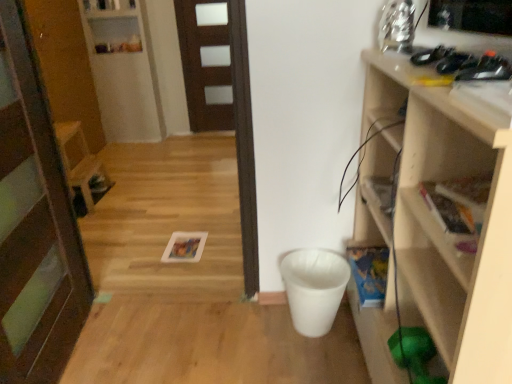
Question: Is white glossy shelf at upper left, the second shelf positioned from the right, bigger than brown matte door at center, placed as the 1th door when sorted from back to front?

Choices:
 (A) no
 (B) yes

Answer: (B)

Question: From a real-world perspective, is white glossy shelf at upper left, which ranks as the 2th shelf in front-to-back order, physically below brown matte door at center, placed as the 1th door when sorted from back to front?

Choices:
 (A) no
 (B) yes

Answer: (A)

Question: Is white glossy shelf at upper left, which ranks as the 2th shelf in front-to-back order, touching brown matte door at center, placed as the 1th door when sorted from back to front?

Choices:
 (A) no
 (B) yes

Answer: (A)

Question: Is there a large distance between white glossy shelf at upper left, the second shelf when ordered from bottom to top, and brown matte door at center, acting as the first door starting from the right?

Choices:
 (A) yes
 (B) no

Answer: (B)

Question: Does white glossy shelf at upper left, the first shelf positioned from the left, lie in front of brown matte door at center, which is the 2th door in left-to-right order?

Choices:
 (A) yes
 (B) no

Answer: (A)

Question: Is white glossy shelf at upper left, which ranks as the 2th shelf in front-to-back order, taller than brown matte door at center, which is the 2th door in left-to-right order?

Choices:
 (A) yes
 (B) no

Answer: (A)

Question: Can you confirm if wooden chair at left is shorter than brown matte door at center, which is the 2th door in left-to-right order?

Choices:
 (A) no
 (B) yes

Answer: (B)

Question: Is wooden chair at left placed right next to brown matte door at center, acting as the first door starting from the top?

Choices:
 (A) yes
 (B) no

Answer: (B)

Question: Is wooden chair at left oriented towards brown matte door at center, which appears as the second door when viewed from the front?

Choices:
 (A) yes
 (B) no

Answer: (B)

Question: Considering the relative positions of wooden chair at left and brown matte door at center, acting as the first door starting from the right, in the image provided, is wooden chair at left behind brown matte door at center, acting as the first door starting from the right,?

Choices:
 (A) yes
 (B) no

Answer: (B)

Question: Is brown matte door at center, acting as the first door starting from the right, inside wooden chair at left?

Choices:
 (A) no
 (B) yes

Answer: (A)

Question: Is the depth of wooden chair at left less than that of brown matte door at center, acting as the first door starting from the top?

Choices:
 (A) no
 (B) yes

Answer: (B)

Question: Is brown matte door at center, the second door ordered from the bottom, looking in the opposite direction of wooden door at center, marked as the second door in a right-to-left arrangement?

Choices:
 (A) no
 (B) yes

Answer: (A)